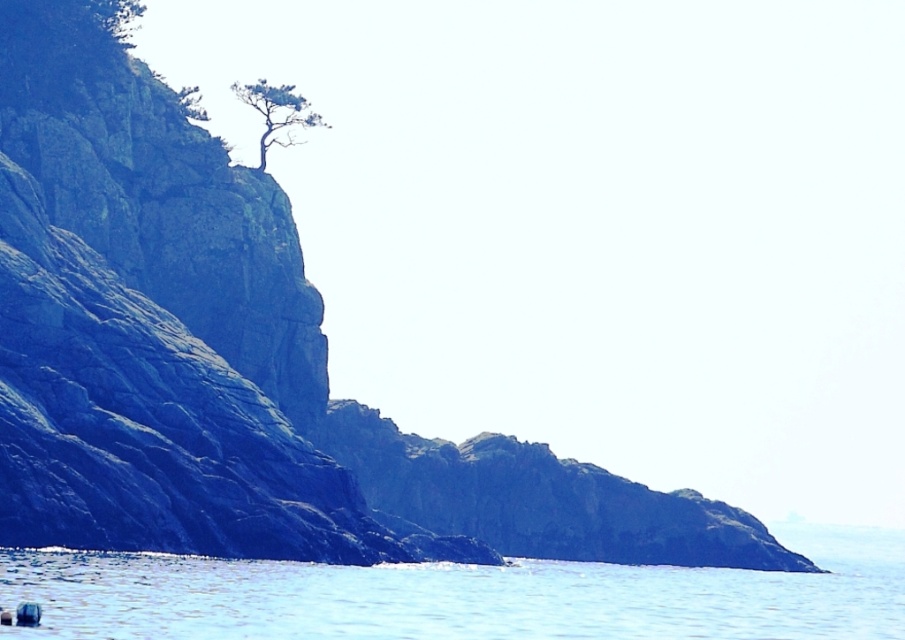
Question: Is green textured tree at upper left in front of green leafy tree at upper left?

Choices:
 (A) no
 (B) yes

Answer: (A)

Question: Based on their relative distances, which object is nearer to the blue water at center?

Choices:
 (A) green textured tree at upper left
 (B) green leafy tree at upper left

Answer: (A)

Question: Which of the following is the farthest from the observer?

Choices:
 (A) (146, 572)
 (B) (115, 26)
 (C) (284, 147)

Answer: (C)

Question: Is green textured tree at upper left in front of green leafy tree at upper left?

Choices:
 (A) no
 (B) yes

Answer: (A)

Question: Considering the real-world distances, which object is closest to the green textured tree at upper left?

Choices:
 (A) blue water at center
 (B) green leafy tree at upper left

Answer: (B)

Question: Is the position of green textured tree at upper left more distant than that of green leafy tree at upper left?

Choices:
 (A) yes
 (B) no

Answer: (A)